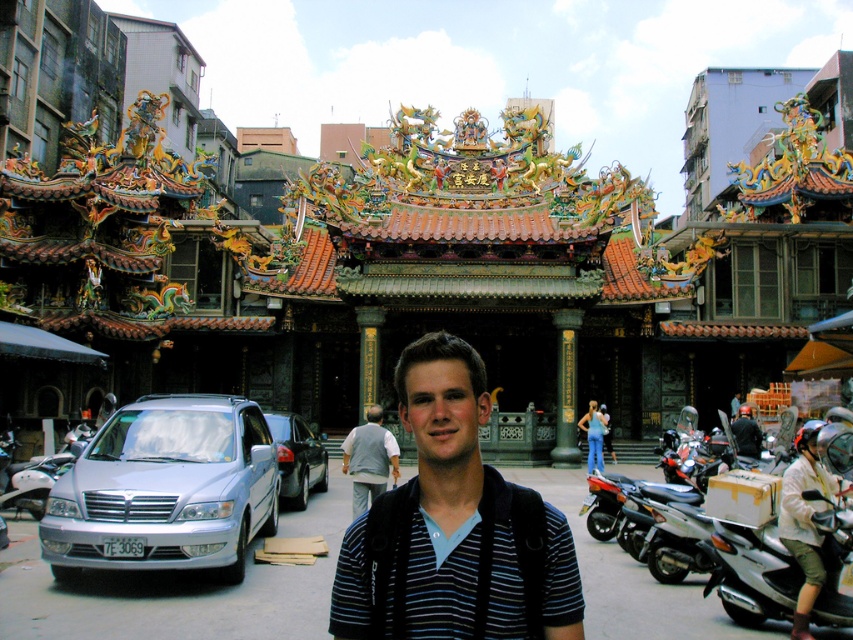
Question: In this image, where is gray fabric pants at center located relative to metallic silver motorcycle at left?

Choices:
 (A) below
 (B) above

Answer: (B)

Question: Which of the following is the closest to the observer?

Choices:
 (A) (416, 381)
 (B) (747, 531)
 (C) (747, 436)

Answer: (A)

Question: Is shiny black sedan at center-left to the right of dark blue shirt at center from the viewer's perspective?

Choices:
 (A) yes
 (B) no

Answer: (B)

Question: Is silver metallic van at left thinner than metallic silver motorcycle at lower right?

Choices:
 (A) yes
 (B) no

Answer: (B)

Question: Which of the following is the closest to the observer?

Choices:
 (A) dark blue shirt at center
 (B) blue striped shirt at center
 (C) shiny black sedan at center-left

Answer: (B)

Question: Which point is closer to the camera?

Choices:
 (A) metallic silver motorcycle at lower right
 (B) shiny black sedan at center-left
 (C) metallic silver motorcycle at left

Answer: (A)